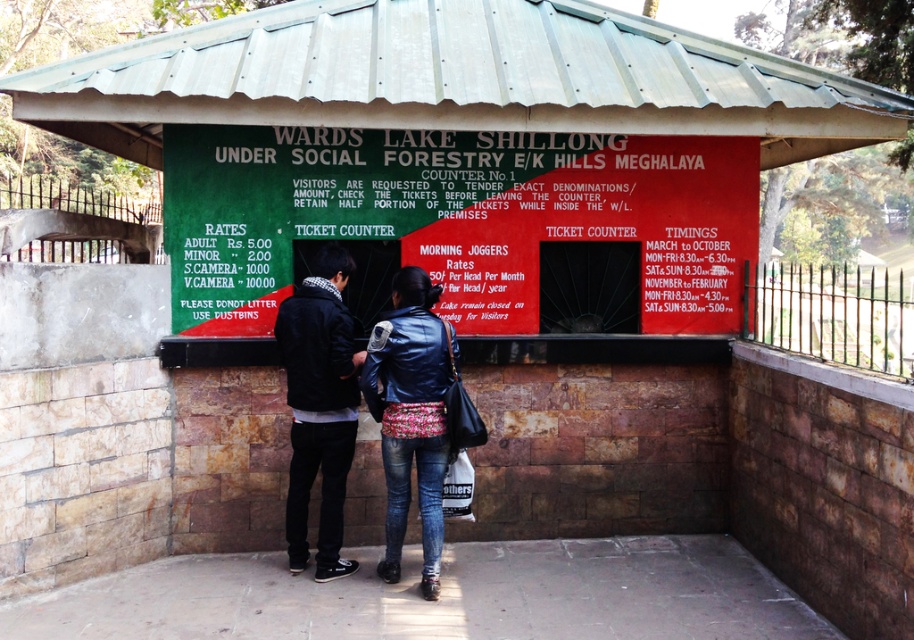
Between green painted board at center and leather jacket at center, which one has more height?

leather jacket at center is taller.

Who is more forward, (711, 221) or (392, 477)?

Point (392, 477) is in front.

This screenshot has width=914, height=640. Describe the element at coordinates (463, 225) in the screenshot. I see `green painted board at center` at that location.

What are the coordinates of `green painted board at center` in the screenshot? It's located at (463, 225).

Can you confirm if green painted board at center is positioned to the right of black leather jacket at center?

Correct, you'll find green painted board at center to the right of black leather jacket at center.

Between point (625, 189) and point (349, 420), which one is positioned in front?

Point (349, 420) is more forward.

Between point (639, 268) and point (299, 458), which one is positioned in front?

Point (299, 458) is in front.

This screenshot has height=640, width=914. What are the coordinates of `green painted board at center` in the screenshot? It's located at (463, 225).

Is green painted board at center taller than dark blue leather jacket at center?

In fact, green painted board at center may be shorter than dark blue leather jacket at center.

Which is more to the left, green painted board at center or dark blue leather jacket at center?

Result: From the viewer's perspective, dark blue leather jacket at center appears more on the left side.

The image size is (914, 640). What do you see at coordinates (463, 225) in the screenshot?
I see `green painted board at center` at bounding box center [463, 225].

At what (x,y) coordinates should I click in order to perform the action: click on green painted board at center. Please return your answer as a coordinate pair (x, y). This screenshot has height=640, width=914. Looking at the image, I should click on (463, 225).